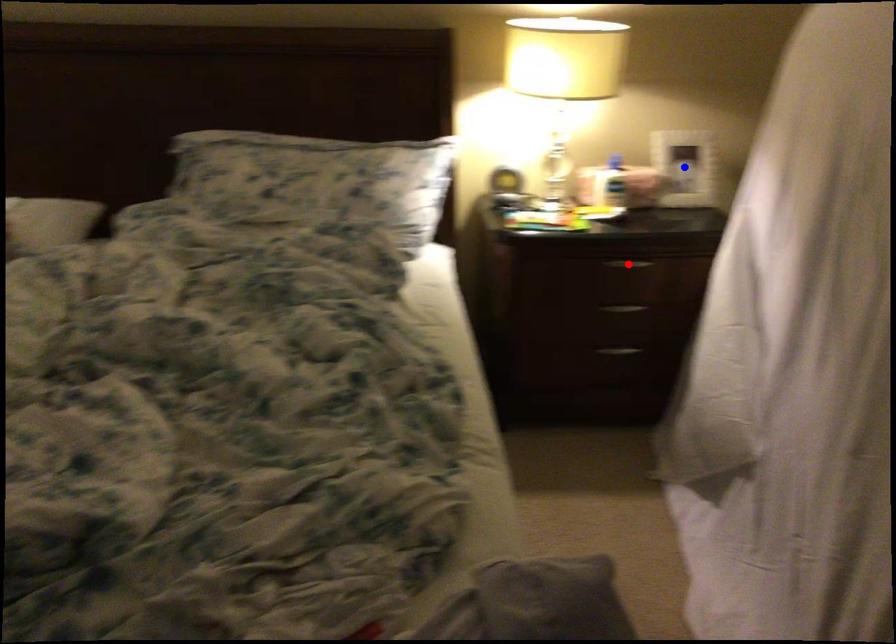
Question: Which of the two points in the image is closer to the camera?

Choices:
 (A) Blue point is closer.
 (B) Red point is closer.

Answer: (B)